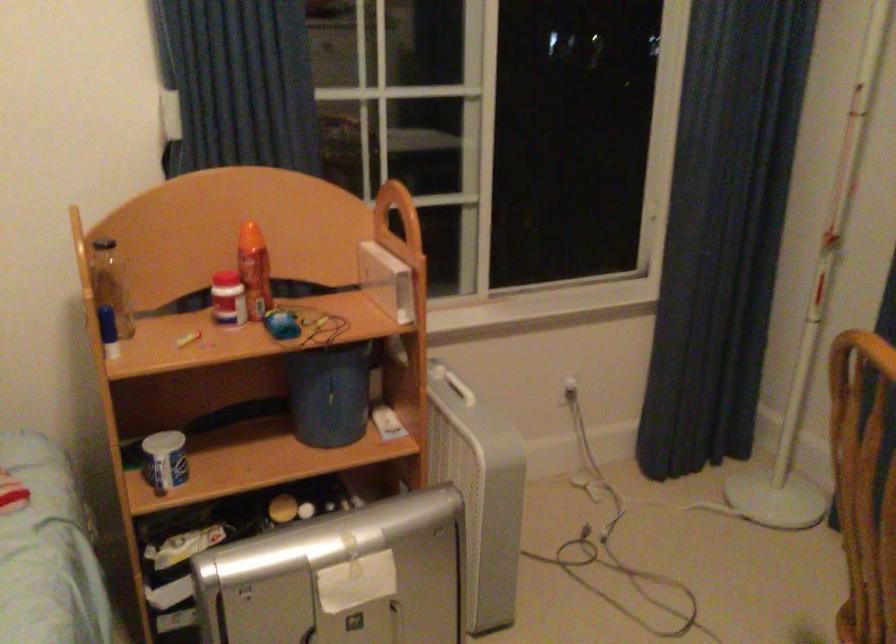
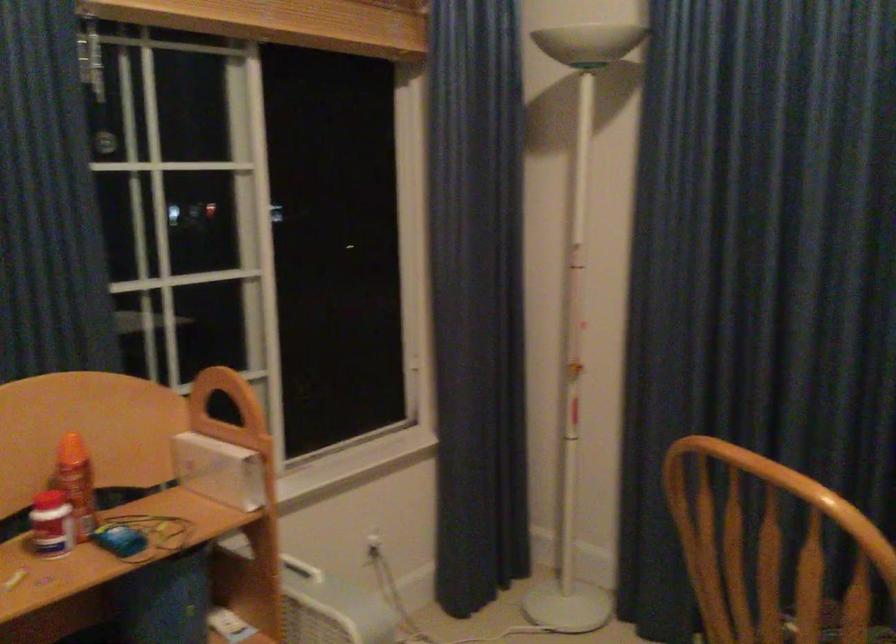
Question: Based on the continuous images, in which direction is the camera rotating? Reply with the corresponding letter.

Choices:
 (A) Left
 (B) Right
 (C) Up
 (D) Down

Answer: (B)